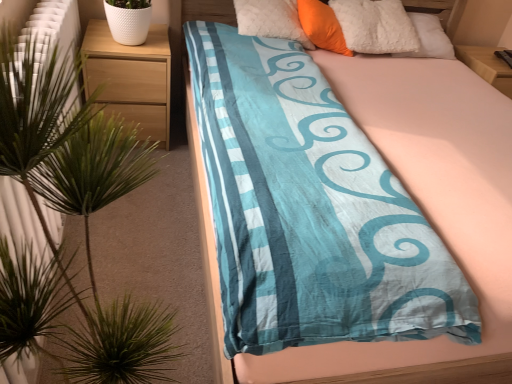
What is the approximate height of blue cotton bed at center?

It is 35.81 inches.

The height and width of the screenshot is (384, 512). I want to click on orange soft pillow at upper center, so click(x=322, y=26).

The image size is (512, 384). Describe the element at coordinates (322, 26) in the screenshot. I see `orange soft pillow at upper center` at that location.

Locate an element on the screen. blue cotton bed at center is located at coordinates (426, 213).

Would you say orange soft pillow at upper center is to the left or to the right of wooden nightstand at left in the picture?

In the image, orange soft pillow at upper center appears on the right side of wooden nightstand at left.

Can you confirm if orange soft pillow at upper center is shorter than wooden nightstand at left?

Yes.

Is orange soft pillow at upper center situated inside wooden nightstand at left or outside?

orange soft pillow at upper center is outside wooden nightstand at left.

Does point (301, 8) come in front of point (134, 102)?

No, (301, 8) is further to viewer.

Considering the relative positions of green leafy plant at left and orange soft pillow at upper center in the image provided, is green leafy plant at left behind orange soft pillow at upper center?

No, green leafy plant at left is in front of orange soft pillow at upper center.

From their relative heights in the image, would you say green leafy plant at left is taller or shorter than orange soft pillow at upper center?

Considering their sizes, green leafy plant at left has more height than orange soft pillow at upper center.

Is green leafy plant at left looking in the opposite direction of orange soft pillow at upper center?

No, orange soft pillow at upper center is not at the back of green leafy plant at left.

Is green leafy plant at left far from orange soft pillow at upper center?

Yes, green leafy plant at left is far from orange soft pillow at upper center.

The width and height of the screenshot is (512, 384). I want to click on pillow above the green leafy plant at left (from a real-world perspective), so click(x=322, y=26).

Considering the sizes of objects orange soft pillow at upper center and green leafy plant at left in the image provided, who is wider, orange soft pillow at upper center or green leafy plant at left?

Wider between the two is green leafy plant at left.

Considering the points (316, 6) and (2, 100), which point is in front, point (316, 6) or point (2, 100)?

Positioned in front is point (2, 100).

Between orange soft pillow at upper center and green leafy plant at left, which one has smaller size?

orange soft pillow at upper center is smaller.

Is wooden nightstand at left to the left of blue cotton bed at center from the viewer's perspective?

Indeed, wooden nightstand at left is positioned on the left side of blue cotton bed at center.

How different are the orientations of wooden nightstand at left and blue cotton bed at center in degrees?

0.554 degrees.

Is wooden nightstand at left thinner than blue cotton bed at center?

Correct, the width of wooden nightstand at left is less than that of blue cotton bed at center.

From a real-world perspective, is blue cotton bed at center physically located above or below orange soft pillow at upper center?

blue cotton bed at center is situated lower than orange soft pillow at upper center in the real world.

Which object is positioned more to the right, blue cotton bed at center or orange soft pillow at upper center?

blue cotton bed at center.

Is blue cotton bed at center completely or partially outside of orange soft pillow at upper center?

blue cotton bed at center is positioned outside orange soft pillow at upper center.

This screenshot has height=384, width=512. In order to click on nightstand on the left of green leafy plant at left in this screenshot , I will do (x=131, y=77).

Can we say wooden nightstand at left lies outside green leafy plant at left?

Absolutely, wooden nightstand at left is external to green leafy plant at left.

Looking at this image, is wooden nightstand at left positioned with its back to green leafy plant at left?

No, wooden nightstand at left is not facing away from green leafy plant at left.

From a real-world perspective, who is located higher, wooden nightstand at left or green leafy plant at left?

green leafy plant at left is physically above.

Could blue cotton bed at center be considered to be inside orange soft pillow at upper center?

Actually, blue cotton bed at center is outside orange soft pillow at upper center.

Does orange soft pillow at upper center appear on the right side of blue cotton bed at center?

No.

Is point (331, 42) positioned behind point (401, 113)?

Yes, point (331, 42) is behind point (401, 113).

Is orange soft pillow at upper center aimed at blue cotton bed at center?

Yes, orange soft pillow at upper center is oriented towards blue cotton bed at center.

Where is `pillow behind the wooden nightstand at left`? The image size is (512, 384). pillow behind the wooden nightstand at left is located at coordinates (322, 26).

The height and width of the screenshot is (384, 512). Find the location of `houseplant lying below the orange soft pillow at upper center (from the image's perspective)`. houseplant lying below the orange soft pillow at upper center (from the image's perspective) is located at coordinates (37, 117).

From the image, which object appears to be farther from wooden nightstand at left, green leafy plant at left or orange soft pillow at upper center?

Among the two, orange soft pillow at upper center is located further to wooden nightstand at left.

Which object lies further to the anchor point green leafy plant at left, blue cotton bed at center or wooden nightstand at left?

blue cotton bed at center.

Considering their positions, is wooden nightstand at left positioned closer to orange soft pillow at upper center than green leafy plant at left?

wooden nightstand at left is closer to orange soft pillow at upper center.

Based on their spatial positions, is blue cotton bed at center or orange soft pillow at upper center closer to green leafy plant at left?

The object closer to green leafy plant at left is blue cotton bed at center.

Estimate the real-world distances between objects in this image. Which object is further from green leafy plant at left, wooden nightstand at left or orange soft pillow at upper center?

orange soft pillow at upper center.

From the image, which object appears to be nearer to wooden nightstand at left, blue cotton bed at center or orange soft pillow at upper center?

blue cotton bed at center is closer to wooden nightstand at left.

Looking at the image, which one is located further to blue cotton bed at center, wooden nightstand at left or orange soft pillow at upper center?

Based on the image, wooden nightstand at left appears to be further to blue cotton bed at center.

Considering their positions, is green leafy plant at left positioned further to blue cotton bed at center than wooden nightstand at left?

green leafy plant at left lies further to blue cotton bed at center than the other object.

Identify the location of nightstand between green leafy plant at left and orange soft pillow at upper center in the front-back direction. (131, 77).

Image resolution: width=512 pixels, height=384 pixels. Find the location of `bed located between green leafy plant at left and orange soft pillow at upper center in the depth direction`. bed located between green leafy plant at left and orange soft pillow at upper center in the depth direction is located at coordinates (426, 213).

The width and height of the screenshot is (512, 384). Identify the location of bed located between green leafy plant at left and wooden nightstand at left in the depth direction. (426, 213).

At what (x,y) coordinates should I click in order to perform the action: click on nightstand located between blue cotton bed at center and orange soft pillow at upper center in the depth direction. Please return your answer as a coordinate pair (x, y). Looking at the image, I should click on (131, 77).